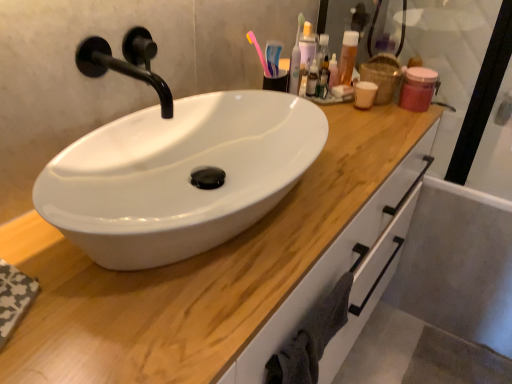
You are a GUI agent. You are given a task and a screenshot of the screen. Output one action in this format:
    pyautogui.click(x=<x>, y=<y>)
    Task: Click on the pink plastic toothbrush at upper right
    The width and height of the screenshot is (512, 384).
    Given the screenshot: What is the action you would take?
    pyautogui.click(x=258, y=52)

Describe the element at coordinates (311, 338) in the screenshot. I see `gray cotton towel at lower right` at that location.

What is the approximate width of white glossy drawer at right?

white glossy drawer at right is 27.55 inches wide.

Consider the image. In order to face wooden at center, should I rotate leftwards or rightwards?

It's best to rotate right around 0.815 degrees.

Where is `pink plastic toothbrush at upper right`? pink plastic toothbrush at upper right is located at coordinates (258, 52).

From a real-world perspective, is black matte faucet at upper left positioned above or below pink plastic toothbrush at upper right?

black matte faucet at upper left is situated higher than pink plastic toothbrush at upper right in the real world.

Is pink plastic toothbrush at upper right surrounded by black matte faucet at upper left?

No, pink plastic toothbrush at upper right is not inside black matte faucet at upper left.

In terms of height, does black matte faucet at upper left look taller or shorter compared to pink plastic toothbrush at upper right?

black matte faucet at upper left is shorter than pink plastic toothbrush at upper right.

This screenshot has width=512, height=384. Identify the location of bath towel on the left of white glossy drawer at right. (311, 338).

Can you tell me how much white glossy drawer at right and gray cotton towel at lower right differ in facing direction?

white glossy drawer at right and gray cotton towel at lower right are facing 89.7 degrees away from each other.

Does white glossy drawer at right turn towards gray cotton towel at lower right?

Yes, white glossy drawer at right is aimed at gray cotton towel at lower right.

Between white glossy drawer at right and gray cotton towel at lower right, which one has more height?

With more height is white glossy drawer at right.

In terms of height, does pink plastic toothbrush at upper right look taller or shorter compared to translucent plastic bottle at upper right?

pink plastic toothbrush at upper right is taller than translucent plastic bottle at upper right.

From the image's perspective, which object appears higher, pink plastic toothbrush at upper right or translucent plastic bottle at upper right?

From the image's view, translucent plastic bottle at upper right is above.

Is pink plastic toothbrush at upper right oriented away from translucent plastic bottle at upper right?

No.

Considering the relative sizes of pink plastic toothbrush at upper right and translucent plastic bottle at upper right in the image provided, is pink plastic toothbrush at upper right wider than translucent plastic bottle at upper right?

Indeed, pink plastic toothbrush at upper right has a greater width compared to translucent plastic bottle at upper right.

Are gray cotton towel at lower right and translucent plastic bottle at upper right located far from each other?

No, gray cotton towel at lower right is not far from translucent plastic bottle at upper right.

Is gray cotton towel at lower right positioned in front of translucent plastic bottle at upper right?

Yes, the depth of gray cotton towel at lower right is less than that of translucent plastic bottle at upper right.

Considering the sizes of gray cotton towel at lower right and translucent plastic bottle at upper right in the image, is gray cotton towel at lower right wider or thinner than translucent plastic bottle at upper right?

Considering their sizes, gray cotton towel at lower right looks broader than translucent plastic bottle at upper right.

What's the angular difference between gray cotton towel at lower right and translucent plastic bottle at upper right's facing directions?

gray cotton towel at lower right and translucent plastic bottle at upper right are facing 4.23 degrees away from each other.

Is point (341, 60) closer to camera compared to point (296, 363)?

That is False.

Locate an element on the screen. The height and width of the screenshot is (384, 512). toiletry located on the right of gray cotton towel at lower right is located at coordinates (348, 56).

Is translucent plastic bottle at upper right positioned beyond the bounds of gray cotton towel at lower right?

Yes.

Are translucent plastic bottle at upper right and gray cotton towel at lower right located far from each other?

translucent plastic bottle at upper right is near gray cotton towel at lower right, not far away.

Which point is more forward, (374, 178) or (269, 71)?

The point (374, 178) is closer to the camera.

Is wooden at center not close to pink plastic toothbrush at upper right?

That's not correct — wooden at center is a little close to pink plastic toothbrush at upper right.

From the image's perspective, is wooden at center positioned above or below pink plastic toothbrush at upper right?

Clearly, from the image's perspective, wooden at center is below pink plastic toothbrush at upper right.

Which object is positioned more to the right, wooden at center or pink plastic toothbrush at upper right?

Positioned to the right is wooden at center.

Does translucent plastic bottle at upper right have a lesser width compared to pink plastic toothbrush at upper right?

Correct, the width of translucent plastic bottle at upper right is less than that of pink plastic toothbrush at upper right.

Considering their positions, is translucent plastic bottle at upper right located in front of or behind pink plastic toothbrush at upper right?

Visually, translucent plastic bottle at upper right is located behind pink plastic toothbrush at upper right.

Is translucent plastic bottle at upper right far from pink plastic toothbrush at upper right?

No.

Is pink plastic toothbrush at upper right surrounded by translucent plastic bottle at upper right?

No, pink plastic toothbrush at upper right is not a part of translucent plastic bottle at upper right.

Image resolution: width=512 pixels, height=384 pixels. Identify the location of tap that is above the pink plastic toothbrush at upper right (from a real-world perspective). (119, 69).

Identify the location of bath lying on the right of gray cotton towel at lower right. This screenshot has width=512, height=384. (458, 265).

From the image, which object appears to be nearer to gray cotton towel at lower right, wooden at center or pink plastic toothbrush at upper right?

Among the two, wooden at center is located nearer to gray cotton towel at lower right.

Which object lies nearer to the anchor point pink plastic toothbrush at upper right, white glossy drawer at right or wooden at center?

Among the two, wooden at center is located nearer to pink plastic toothbrush at upper right.

Considering their positions, is wooden at center positioned further to translucent plastic bottle at upper right than pink plastic toothbrush at upper right?

Based on the image, wooden at center appears to be further to translucent plastic bottle at upper right.

When comparing their distances from gray cotton towel at lower right, does pink plastic toothbrush at upper right or black matte faucet at upper left seem closer?

Based on the image, black matte faucet at upper left appears to be nearer to gray cotton towel at lower right.

Based on their spatial positions, is translucent plastic bottle at upper right or wooden at center closer to black matte faucet at upper left?

wooden at center is closer to black matte faucet at upper left.

Estimate the real-world distances between objects in this image. Which object is further from wooden at center, translucent plastic bottle at upper right or black matte faucet at upper left?

translucent plastic bottle at upper right.

Considering their positions, is pink plastic toothbrush at upper right positioned closer to wooden at center than translucent plastic bottle at upper right?

pink plastic toothbrush at upper right is closer to wooden at center.

Estimate the real-world distances between objects in this image. Which object is further from white glossy drawer at right, wooden at center or black matte faucet at upper left?

black matte faucet at upper left lies further to white glossy drawer at right than the other object.

The width and height of the screenshot is (512, 384). I want to click on toiletry situated between gray cotton towel at lower right and white glossy drawer at right from left to right, so click(x=348, y=56).

Locate an element on the screen. Image resolution: width=512 pixels, height=384 pixels. tap positioned between wooden at center and pink plastic toothbrush at upper right from near to far is located at coordinates (119, 69).

Locate an element on the screen. Image resolution: width=512 pixels, height=384 pixels. counter top situated between pink plastic toothbrush at upper right and white glossy drawer at right from left to right is located at coordinates [195, 273].

Locate an element on the screen. The image size is (512, 384). toothbrush situated between black matte faucet at upper left and white glossy drawer at right from left to right is located at coordinates (258, 52).